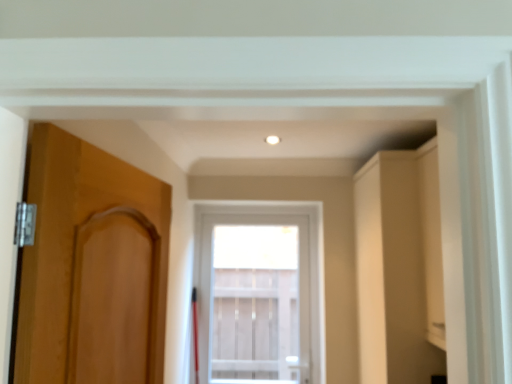
Question: Does matte wood door at left have a lesser height compared to clear glass window at center?

Choices:
 (A) yes
 (B) no

Answer: (A)

Question: From the image's perspective, would you say matte wood door at left is shown under clear glass window at center?

Choices:
 (A) yes
 (B) no

Answer: (B)

Question: Is matte wood door at left oriented towards clear glass window at center?

Choices:
 (A) yes
 (B) no

Answer: (B)

Question: Is clear glass window at center located within matte wood door at left?

Choices:
 (A) yes
 (B) no

Answer: (B)

Question: Is matte wood door at left thinner than clear glass window at center?

Choices:
 (A) no
 (B) yes

Answer: (B)

Question: Would you say clear glass window at center is to the left or to the right of matte wood door at left in the picture?

Choices:
 (A) right
 (B) left

Answer: (A)

Question: Is clear glass window at center spatially inside matte wood door at left, or outside of it?

Choices:
 (A) inside
 (B) outside

Answer: (B)

Question: From a real-world perspective, is clear glass window at center above or below matte wood door at left?

Choices:
 (A) above
 (B) below

Answer: (B)

Question: Looking at the image, does clear glass window at center seem bigger or smaller compared to matte wood door at left?

Choices:
 (A) small
 (B) big

Answer: (B)

Question: Considering the positions of matte wood door at left and clear glass window at center in the image, is matte wood door at left bigger or smaller than clear glass window at center?

Choices:
 (A) big
 (B) small

Answer: (B)

Question: Based on their positions, is matte wood door at left located to the left or right of clear glass window at center?

Choices:
 (A) right
 (B) left

Answer: (B)

Question: Is point (82, 157) positioned closer to the camera than point (257, 355)?

Choices:
 (A) farther
 (B) closer

Answer: (B)

Question: Relative to clear glass window at center, is matte wood door at left in front or behind?

Choices:
 (A) behind
 (B) front

Answer: (B)

Question: In terms of size, does matte beige cabinet at right appear bigger or smaller than clear glass window at center?

Choices:
 (A) big
 (B) small

Answer: (A)

Question: From a real-world perspective, relative to clear glass window at center, is matte beige cabinet at right vertically above or below?

Choices:
 (A) above
 (B) below

Answer: (A)